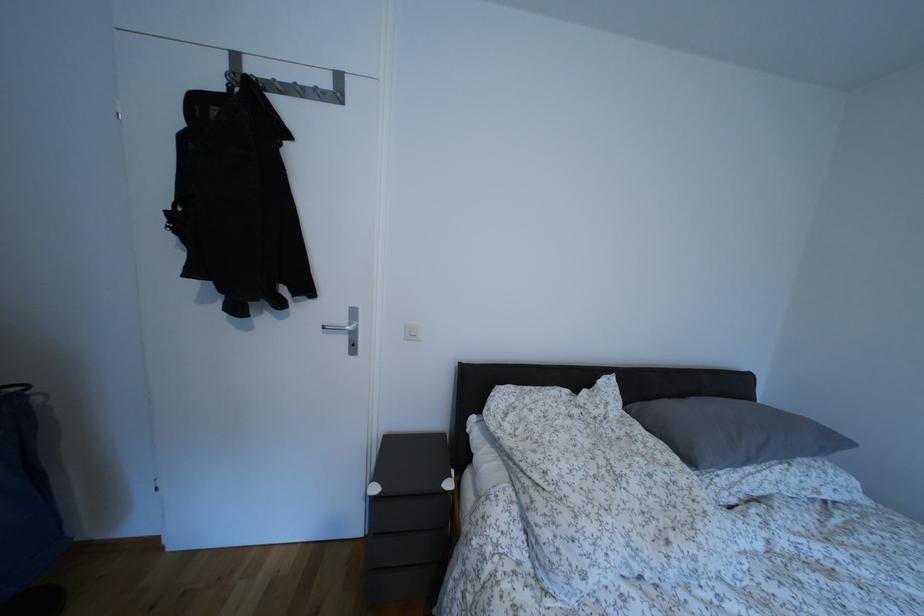
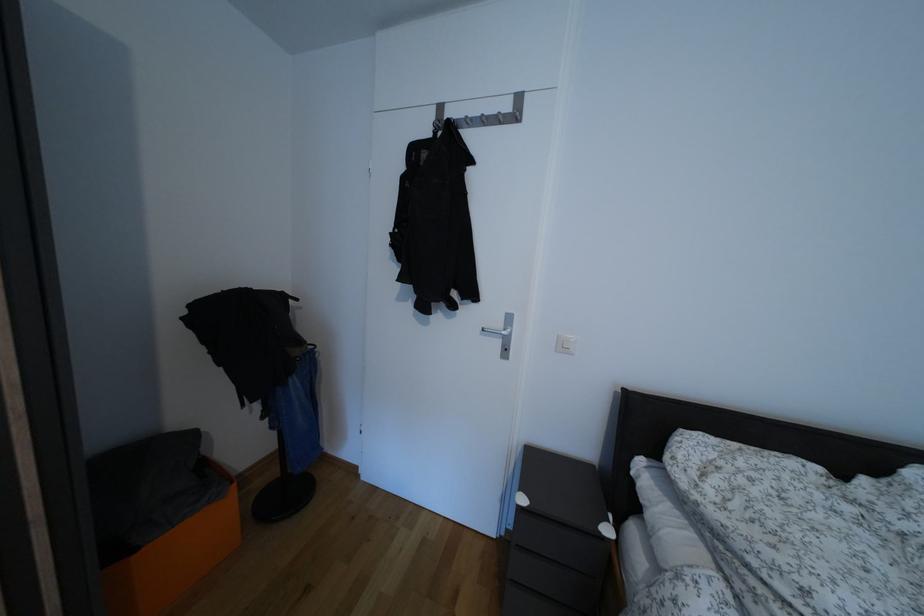
Question: The camera is either moving clockwise (left) or counter-clockwise (right) around the object. The first image is from the beginning of the video and the second image is from the end. Is the camera moving left or right when shooting the video?

Choices:
 (A) Left
 (B) Right

Answer: (B)